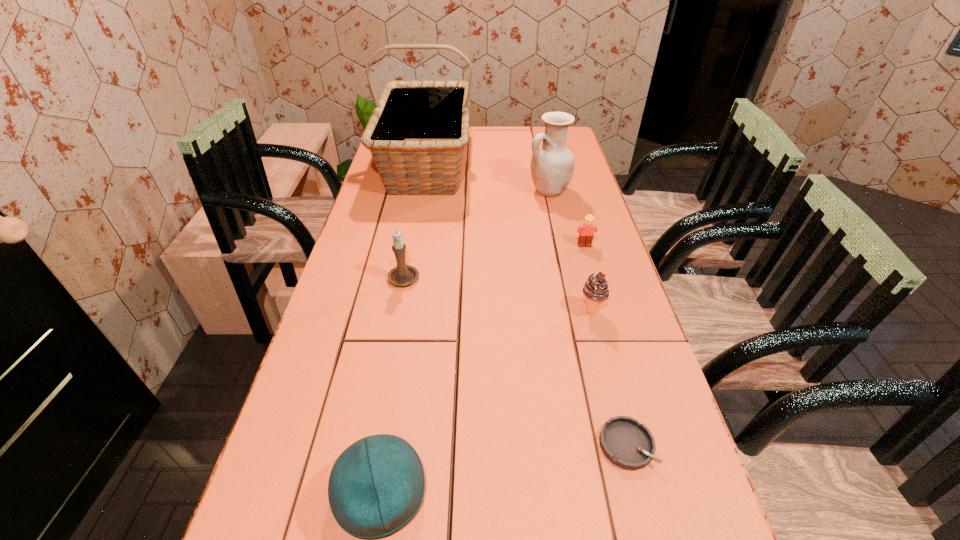
Locate an element on the screen. The height and width of the screenshot is (540, 960). basket is located at coordinates (417, 132).

Image resolution: width=960 pixels, height=540 pixels. I want to click on the second tallest object, so click(552, 164).

Identify the location of candle holder. The height and width of the screenshot is (540, 960). (403, 275).

Locate an element on the screen. This screenshot has width=960, height=540. the fourth nearest object is located at coordinates (403, 275).

Where is `the third nearest object`? Image resolution: width=960 pixels, height=540 pixels. the third nearest object is located at coordinates (596, 290).

Where is `Lego`? Lego is located at coordinates (586, 231).

Locate an element on the screen. Image resolution: width=960 pixels, height=540 pixels. the second shortest object is located at coordinates (586, 231).

Identify the location of the shortest object. This screenshot has width=960, height=540. (626, 443).

Identify the location of free space located by the handle of the basket. (408, 269).

The height and width of the screenshot is (540, 960). Identify the location of vacant space located on the back of the pottery. (541, 159).